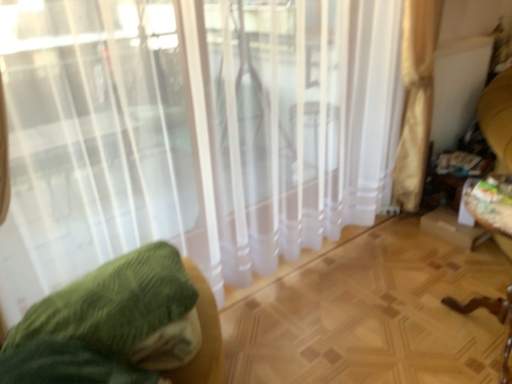
Image resolution: width=512 pixels, height=384 pixels. I want to click on white sheer curtain at center, so click(191, 132).

You are a GUI agent. You are given a task and a screenshot of the screen. Output one action in this format:
    pyautogui.click(x=<x>, y=<y>)
    Task: Click on the white sheer curtain at center
    This screenshot has height=384, width=512.
    Given the screenshot: What is the action you would take?
    tap(191, 132)

Considering the relative sizes of wooden swivel chair at right and green fabric cushion at left in the image provided, is wooden swivel chair at right taller than green fabric cushion at left?

Correct, wooden swivel chair at right is much taller as green fabric cushion at left.

Can you confirm if wooden swivel chair at right is smaller than green fabric cushion at left?

Indeed, wooden swivel chair at right has a smaller size compared to green fabric cushion at left.

Is wooden swivel chair at right looking in the opposite direction of green fabric cushion at left?

wooden swivel chair at right does not have its back to green fabric cushion at left.

Which object is closer to the camera taking this photo, white sheer curtain at center or wooden swivel chair at right?

white sheer curtain at center.

Is white sheer curtain at center beside wooden swivel chair at right?

No, white sheer curtain at center is not beside wooden swivel chair at right.

Considering the points (234, 238) and (509, 208), which point is in front, point (234, 238) or point (509, 208)?

The point (509, 208) is in front.

At what (x,y) coordinates should I click in order to perform the action: click on swivel chair behind the white sheer curtain at center. Please return your answer as a coordinate pair (x, y). The height and width of the screenshot is (384, 512). Looking at the image, I should click on (488, 206).

Between green fabric cushion at left and wooden swivel chair at right, which one has smaller width?

wooden swivel chair at right is thinner.

From a real-world perspective, which is physically above, green fabric cushion at left or wooden swivel chair at right?

From a 3D spatial view, wooden swivel chair at right is above.

Does green fabric cushion at left have a smaller size compared to wooden swivel chair at right?

No, green fabric cushion at left is not smaller than wooden swivel chair at right.

What's the angular difference between green fabric cushion at left and wooden swivel chair at right's facing directions?

There is a 41.8-degree angle between the facing directions of green fabric cushion at left and wooden swivel chair at right.

Considering the positions of points (141, 325) and (98, 161), is point (141, 325) closer to camera compared to point (98, 161)?

Yes, point (141, 325) is in front of point (98, 161).

Looking at this image, from a real-world perspective, relative to white sheer curtain at center, is green fabric cushion at left vertically above or below?

green fabric cushion at left is situated lower than white sheer curtain at center in the real world.

In the image, is green fabric cushion at left positioned in front of or behind white sheer curtain at center?

green fabric cushion at left is behind white sheer curtain at center.

Is green fabric cushion at left with white sheer curtain at center?

No.

Is white sheer curtain at center to the left or to the right of green fabric cushion at left in the image?

From the image, it's evident that white sheer curtain at center is to the right of green fabric cushion at left.

Considering the relative sizes of white sheer curtain at center and green fabric cushion at left in the image provided, is white sheer curtain at center taller than green fabric cushion at left?

Indeed, white sheer curtain at center has a greater height compared to green fabric cushion at left.

Does white sheer curtain at center touch green fabric cushion at left?

There is a gap between white sheer curtain at center and green fabric cushion at left.

Which point is more forward, (84, 214) or (60, 307)?

The point (60, 307) is more forward.

Is wooden swivel chair at right turned away from white sheer curtain at center?

That's right, wooden swivel chair at right is facing away from white sheer curtain at center.

Is wooden swivel chair at right positioned in front of white sheer curtain at center?

No, wooden swivel chair at right is behind white sheer curtain at center.

Is wooden swivel chair at right in contact with white sheer curtain at center?

No, wooden swivel chair at right is not in contact with white sheer curtain at center.

Which is in front, point (510, 331) or point (143, 146)?

The point (143, 146) is in front.

Where is `swivel chair above the green fabric cushion at left (from a real-world perspective)`? This screenshot has width=512, height=384. swivel chair above the green fabric cushion at left (from a real-world perspective) is located at coordinates [x=488, y=206].

You are a GUI agent. You are given a task and a screenshot of the screen. Output one action in this format:
    pyautogui.click(x=<x>, y=<y>)
    Task: Click on the curtain in front of the wooden swivel chair at right
    
    Given the screenshot: What is the action you would take?
    tap(191, 132)

Which object lies nearer to the anchor point green fabric cushion at left, white sheer curtain at center or wooden swivel chair at right?

The object closer to green fabric cushion at left is white sheer curtain at center.

From the image, which object appears to be farther from wooden swivel chair at right, green fabric cushion at left or white sheer curtain at center?

green fabric cushion at left.

Based on their spatial positions, is green fabric cushion at left or wooden swivel chair at right closer to white sheer curtain at center?

green fabric cushion at left.

Based on their spatial positions, is white sheer curtain at center or green fabric cushion at left further from wooden swivel chair at right?

green fabric cushion at left is further to wooden swivel chair at right.

Based on their spatial positions, is wooden swivel chair at right or green fabric cushion at left closer to white sheer curtain at center?

green fabric cushion at left is closer to white sheer curtain at center.

Looking at the image, which one is located closer to green fabric cushion at left, wooden swivel chair at right or white sheer curtain at center?

white sheer curtain at center is positioned closer to the anchor green fabric cushion at left.

Find the location of a particular element. This screenshot has height=384, width=512. curtain situated between green fabric cushion at left and wooden swivel chair at right from left to right is located at coordinates (191, 132).